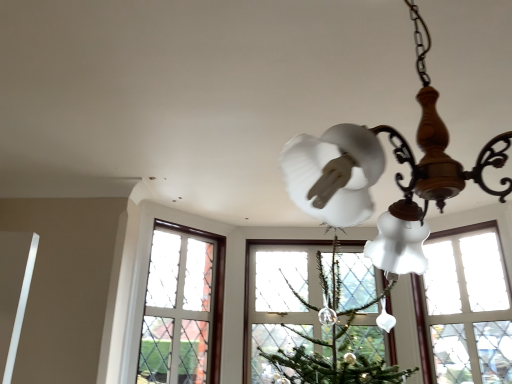
Measure the distance between clear glass window at center and camera.

The depth of clear glass window at center is 7.85 feet.

The width and height of the screenshot is (512, 384). Find the location of `clear glass window at center`. clear glass window at center is located at coordinates (463, 305).

The width and height of the screenshot is (512, 384). Describe the element at coordinates (463, 305) in the screenshot. I see `clear glass window at center` at that location.

Where is `matte white glass chandelier at upper right`? The height and width of the screenshot is (384, 512). matte white glass chandelier at upper right is located at coordinates (382, 172).

The image size is (512, 384). Describe the element at coordinates (382, 172) in the screenshot. I see `matte white glass chandelier at upper right` at that location.

Find the location of `clear glass window at center`. clear glass window at center is located at coordinates (463, 305).

Considering the relative positions of clear glass window at center and matte white glass chandelier at upper right in the image provided, is clear glass window at center to the right of matte white glass chandelier at upper right from the viewer's perspective?

Correct, you'll find clear glass window at center to the right of matte white glass chandelier at upper right.

From the picture: Which object is further away from the camera, clear glass window at center or matte white glass chandelier at upper right?

clear glass window at center.

Does point (473, 374) lie behind point (400, 184)?

Yes, point (473, 374) is farther from viewer.

From the image's perspective, which object appears higher, clear glass window at center or matte white glass chandelier at upper right?

From the image's view, matte white glass chandelier at upper right is above.

From a real-world perspective, is clear glass window at center above or below matte white glass chandelier at upper right?

clear glass window at center is below matte white glass chandelier at upper right.

Is clear glass window at center wider or thinner than matte white glass chandelier at upper right?

clear glass window at center is thinner than matte white glass chandelier at upper right.

Between clear glass window at center and matte white glass chandelier at upper right, which one has more height?

clear glass window at center.

Is clear glass window at center smaller than matte white glass chandelier at upper right?

Indeed, clear glass window at center has a smaller size compared to matte white glass chandelier at upper right.

Can we say clear glass window at center lies outside matte white glass chandelier at upper right?

Absolutely, clear glass window at center is external to matte white glass chandelier at upper right.

Is clear glass window at center directly adjacent to matte white glass chandelier at upper right?

No, clear glass window at center is not beside matte white glass chandelier at upper right.

Could you tell me if clear glass window at center is facing matte white glass chandelier at upper right?

Yes, clear glass window at center faces towards matte white glass chandelier at upper right.

Locate an element on the screen. Image resolution: width=512 pixels, height=384 pixels. window below the matte white glass chandelier at upper right (from a real-world perspective) is located at coordinates [463, 305].

Considering the relative positions of matte white glass chandelier at upper right and clear glass window at center in the image provided, is matte white glass chandelier at upper right to the right of clear glass window at center from the viewer's perspective?

No.

Between matte white glass chandelier at upper right and clear glass window at center, which one is positioned in front?

matte white glass chandelier at upper right is in front.

Between point (416, 180) and point (419, 320), which one is positioned behind?

The point (419, 320) is farther from the camera.

From the image's perspective, who appears lower, matte white glass chandelier at upper right or clear glass window at center?

clear glass window at center appears lower in the image.

From a real-world perspective, who is located lower, matte white glass chandelier at upper right or clear glass window at center?

clear glass window at center.

Can you confirm if matte white glass chandelier at upper right is thinner than clear glass window at center?

No, matte white glass chandelier at upper right is not thinner than clear glass window at center.

Which of these two, matte white glass chandelier at upper right or clear glass window at center, stands shorter?

matte white glass chandelier at upper right is shorter.

Which of these two, matte white glass chandelier at upper right or clear glass window at center, is smaller?

Smaller between the two is clear glass window at center.

In the scene shown: Is matte white glass chandelier at upper right outside of clear glass window at center?

Yes, matte white glass chandelier at upper right is outside of clear glass window at center.

Is matte white glass chandelier at upper right far away from clear glass window at center?

That's right, there is a large distance between matte white glass chandelier at upper right and clear glass window at center.

Is clear glass window at center at the back of matte white glass chandelier at upper right?

No.

How far apart are matte white glass chandelier at upper right and clear glass window at center?

A distance of 6.42 feet exists between matte white glass chandelier at upper right and clear glass window at center.

You are a GUI agent. You are given a task and a screenshot of the screen. Output one action in this format:
    pyautogui.click(x=<x>, y=<y>)
    Task: Click on the window on the right of matte white glass chandelier at upper right
    
    Given the screenshot: What is the action you would take?
    pyautogui.click(x=463, y=305)

Where is `window that is under the matte white glass chandelier at upper right (from a real-world perspective)`? The height and width of the screenshot is (384, 512). window that is under the matte white glass chandelier at upper right (from a real-world perspective) is located at coordinates (463, 305).

I want to click on lamp that is in front of the clear glass window at center, so click(x=382, y=172).